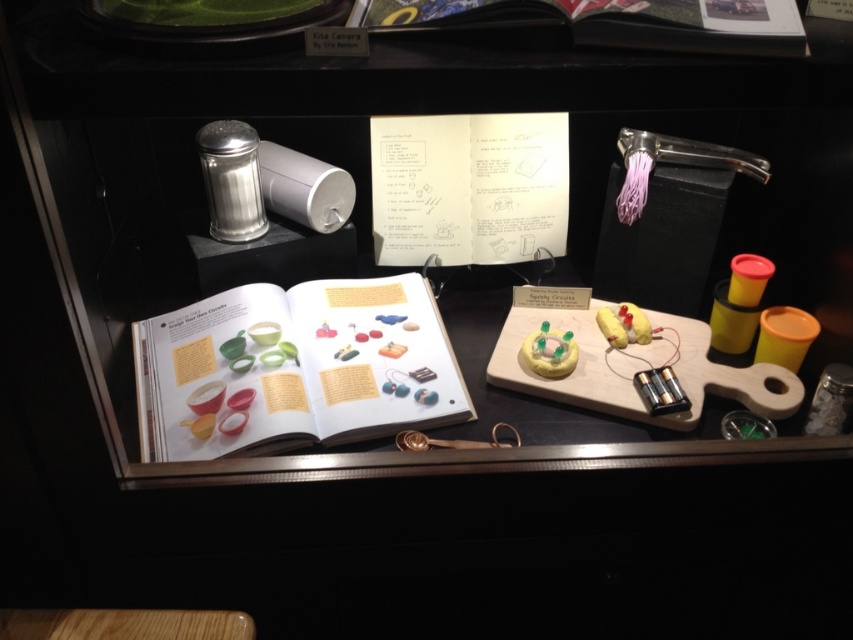
Question: Which object appears closest to the camera in this image?

Choices:
 (A) white paper book at upper center
 (B) brushed metal shaker at upper left

Answer: (A)

Question: Among these points, which one is farthest from the camera?

Choices:
 (A) (245, 164)
 (B) (653, 20)
 (C) (256, 289)

Answer: (C)

Question: Which point is farther from the camera taking this photo?

Choices:
 (A) (316, 348)
 (B) (212, 204)
 (C) (363, 19)

Answer: (B)

Question: Is matte paper book at center above brushed metal shaker at upper left?

Choices:
 (A) yes
 (B) no

Answer: (B)

Question: Is white paper book at upper center wider than brushed metal shaker at upper left?

Choices:
 (A) yes
 (B) no

Answer: (A)

Question: Where is matte paper book at center located in relation to white paper book at upper center in the image?

Choices:
 (A) right
 (B) left

Answer: (B)